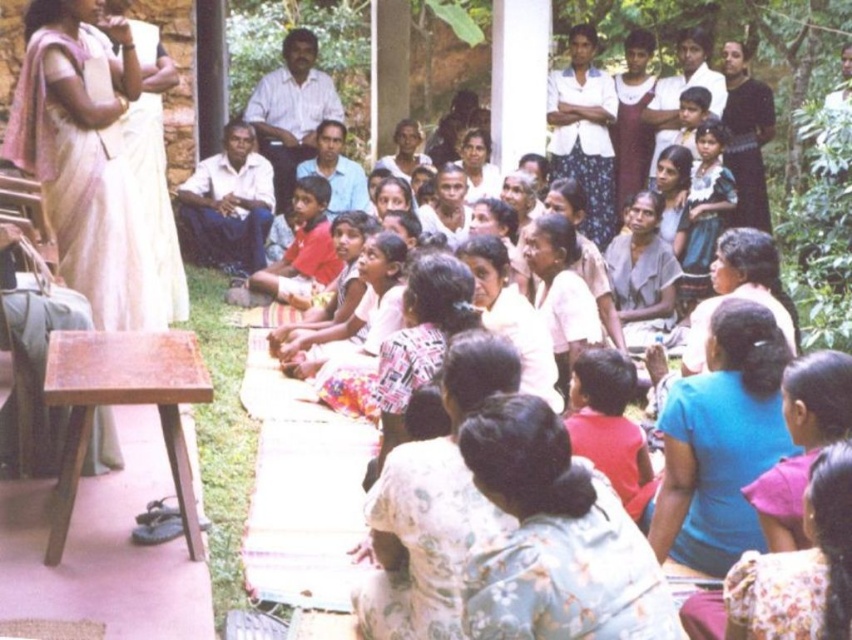
How distant is blue fabric shirt at lower right from white cotton shirt at center?

blue fabric shirt at lower right and white cotton shirt at center are 13.15 meters apart from each other.

Does blue fabric shirt at lower right have a greater height compared to white cotton shirt at center?

Yes, blue fabric shirt at lower right is taller than white cotton shirt at center.

The image size is (852, 640). What are the coordinates of `blue fabric shirt at lower right` in the screenshot? It's located at (720, 442).

Is point (649, 604) more distant than point (709, 436)?

No, (649, 604) is closer to viewer.

Between point (551, 611) and point (753, 422), which one is positioned in front?

Positioned in front is point (551, 611).

In order to click on floral fabric dress at center in this screenshot , I will do (554, 538).

Can you confirm if floral fabric dress at center is positioned to the left of white cotton shirt at center?

Yes, floral fabric dress at center is to the left of white cotton shirt at center.

Between floral fabric dress at center and white cotton shirt at center, which one has more height?

With more height is white cotton shirt at center.

What do you see at coordinates (554, 538) in the screenshot? I see `floral fabric dress at center` at bounding box center [554, 538].

Identify the location of floral fabric dress at center. (554, 538).